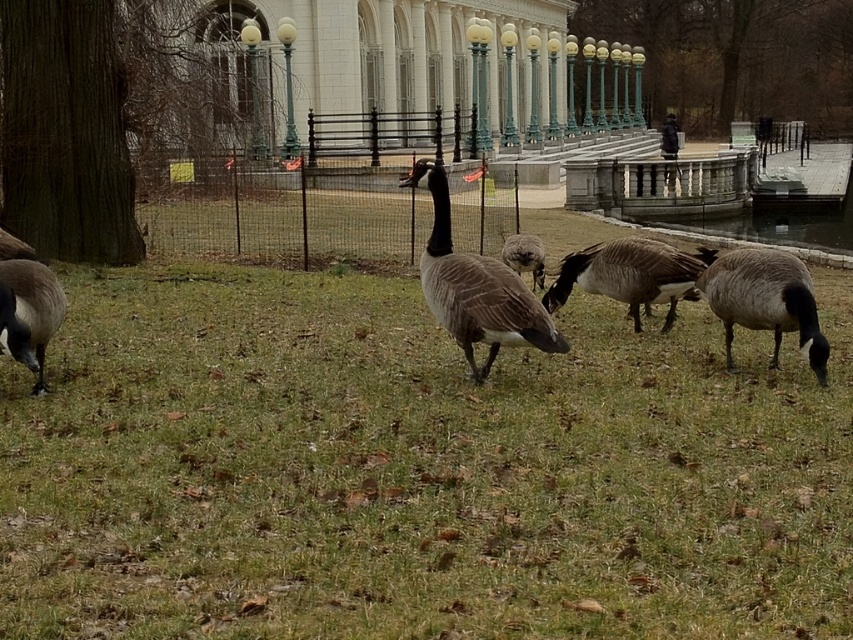
You are standing at the point with coordinates point (764, 300). Looking around, you see a brown feathered goose at center. Which direction should you walk to get closer to the brown feathered goose at center?

Since you are already at the point indicating the brown feathered goose at center, you are already at the location of the brown feathered goose at center. There is no need to move further.

You are a park visitor who wants to feed the birds. You have a bag of bird feed. The brown feathered goose at center is aggressive and will peck you if you get too close. The brown matte duck at center is friendly and will come to you. Which bird should you approach to avoid getting pecked?

You should approach the brown matte duck at center because it is friendly and will come to you, while the brown feathered goose at center is aggressive and may peck you if you get too close.

You are standing in the park and want to take a photo of the two points mentioned. Which point is closer to you, point [780,323] or point [672,256]?

Point [780,323] is closer to the viewer than point [672,256].